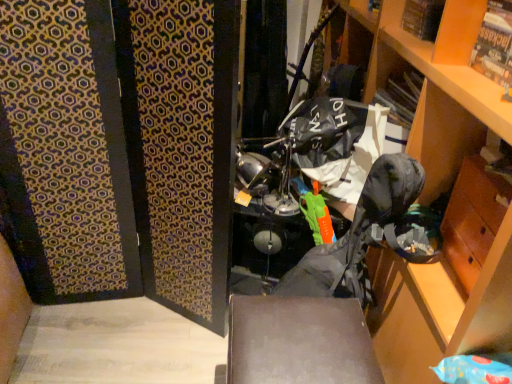
Question: Can you confirm if camouflage fabric folding chair at center is smaller than wooden cabinet at right?

Choices:
 (A) no
 (B) yes

Answer: (B)

Question: From the image's perspective, is camouflage fabric folding chair at center below wooden cabinet at right?

Choices:
 (A) yes
 (B) no

Answer: (A)

Question: Is camouflage fabric folding chair at center at the left side of wooden cabinet at right?

Choices:
 (A) yes
 (B) no

Answer: (A)

Question: Can you confirm if camouflage fabric folding chair at center is thinner than wooden cabinet at right?

Choices:
 (A) no
 (B) yes

Answer: (B)

Question: Is camouflage fabric folding chair at center positioned before wooden cabinet at right?

Choices:
 (A) no
 (B) yes

Answer: (A)

Question: Considering the positions of wooden cabinet at right and matte cardboard magazine at upper right in the image, is wooden cabinet at right taller or shorter than matte cardboard magazine at upper right?

Choices:
 (A) tall
 (B) short

Answer: (A)

Question: From the image's perspective, is wooden cabinet at right above or below matte cardboard magazine at upper right?

Choices:
 (A) above
 (B) below

Answer: (B)

Question: Does point (450, 311) appear closer or farther from the camera than point (510, 34)?

Choices:
 (A) closer
 (B) farther

Answer: (B)

Question: Relative to matte cardboard magazine at upper right, is wooden cabinet at right in front or behind?

Choices:
 (A) front
 (B) behind

Answer: (A)

Question: From a real-world perspective, is camouflage fabric folding chair at center positioned above or below matte cardboard magazine at upper right?

Choices:
 (A) above
 (B) below

Answer: (B)

Question: In terms of height, does camouflage fabric folding chair at center look taller or shorter compared to matte cardboard magazine at upper right?

Choices:
 (A) short
 (B) tall

Answer: (B)

Question: From the image's perspective, is camouflage fabric folding chair at center above or below matte cardboard magazine at upper right?

Choices:
 (A) above
 (B) below

Answer: (B)

Question: Considering the positions of camouflage fabric folding chair at center and matte cardboard magazine at upper right in the image, is camouflage fabric folding chair at center bigger or smaller than matte cardboard magazine at upper right?

Choices:
 (A) small
 (B) big

Answer: (B)

Question: Considering the positions of point click(x=454, y=175) and point click(x=237, y=312), is point click(x=454, y=175) closer or farther from the camera than point click(x=237, y=312)?

Choices:
 (A) closer
 (B) farther

Answer: (A)

Question: Looking at their shapes, would you say wooden cabinet at right is wider or thinner than matte black box at center?

Choices:
 (A) thin
 (B) wide

Answer: (B)